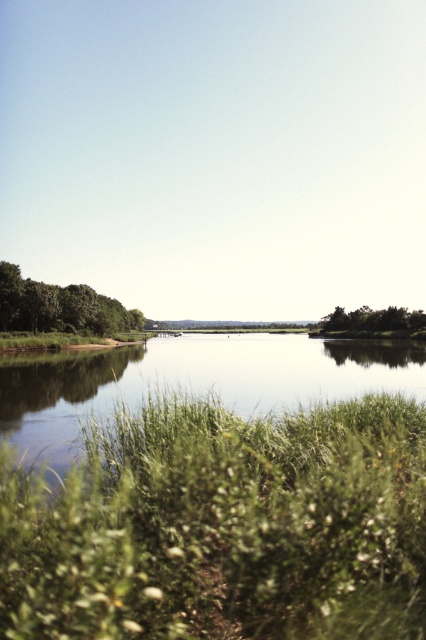
You are a GUI agent. You are given a task and a screenshot of the screen. Output one action in this format:
    pyautogui.click(x=<x>, y=<y>)
    Task: Click on the green matte tree at left
    The width and height of the screenshot is (426, 640).
    Given the screenshot: What is the action you would take?
    pyautogui.click(x=60, y=307)

Find the location of a particular element. This screenshot has height=640, width=426. green matte tree at left is located at coordinates (60, 307).

Which is in front, point (334, 474) or point (120, 385)?

Point (334, 474) is in front.

Is green fuzzy grass at lower center closer to camera compared to green grassy river at center?

Yes, green fuzzy grass at lower center is in front of green grassy river at center.

Describe the element at coordinates (222, 528) in the screenshot. I see `green fuzzy grass at lower center` at that location.

Image resolution: width=426 pixels, height=640 pixels. Find the location of `green fuzzy grass at lower center`. green fuzzy grass at lower center is located at coordinates (222, 528).

How far apart are green grassy river at center and green leafy tree at center?

The distance of green grassy river at center from green leafy tree at center is 32.77 meters.

Can you confirm if green grassy river at center is positioned below green leafy tree at center?

Correct, green grassy river at center is located below green leafy tree at center.

Is point (402, 374) behind point (354, 323)?

That is False.

This screenshot has width=426, height=640. I want to click on green grassy river at center, so click(x=192, y=381).